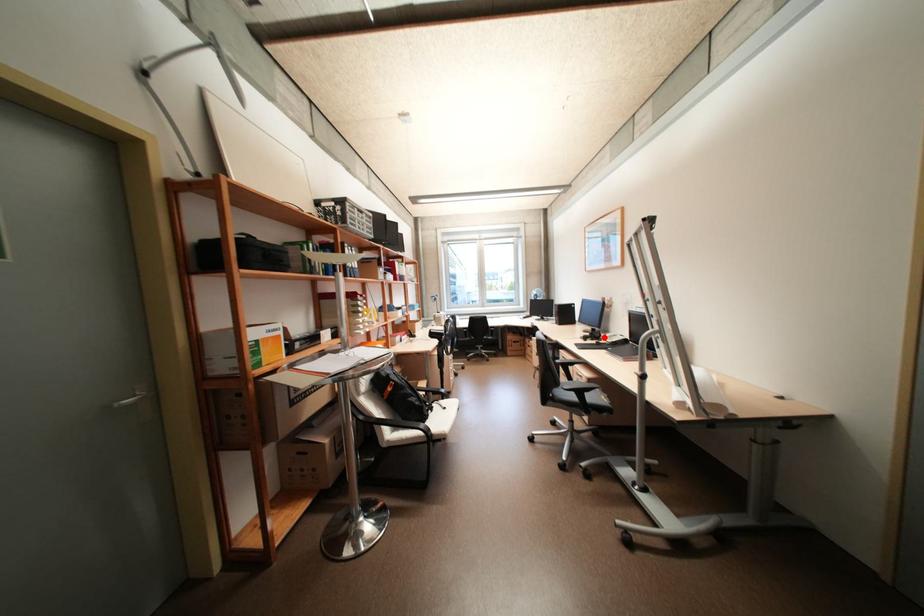
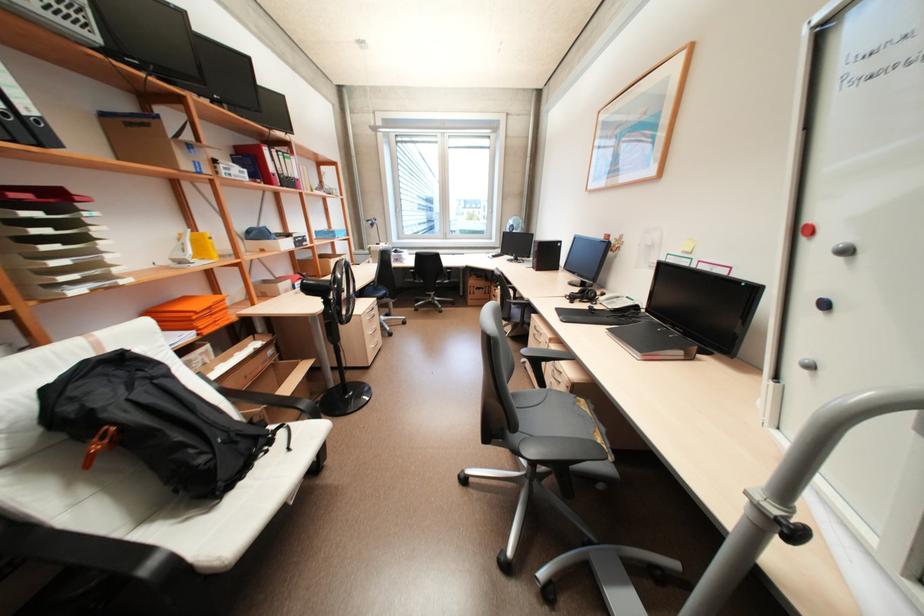
The point at the highlighted location is marked in the first image. Where is the corresponding point in the second image?

(598, 299)